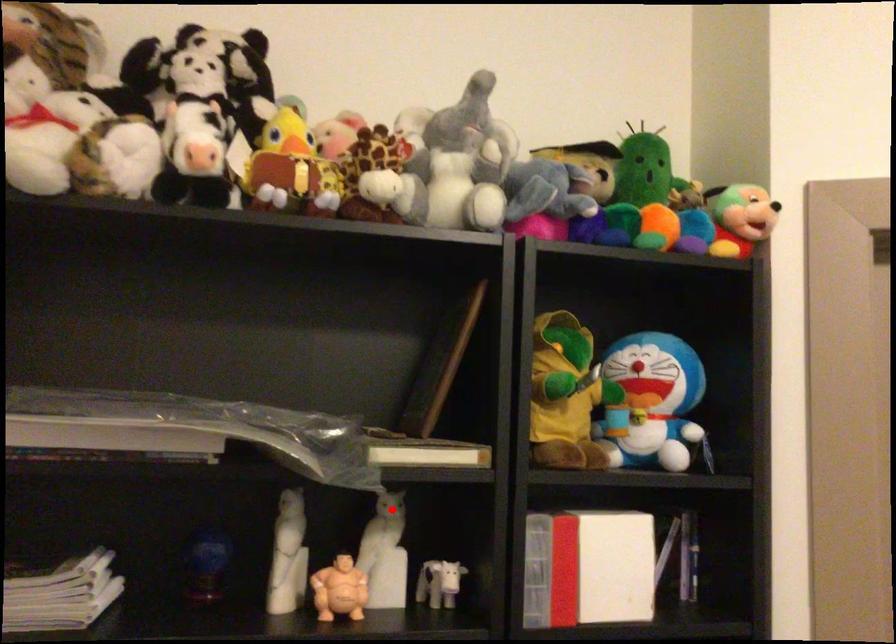
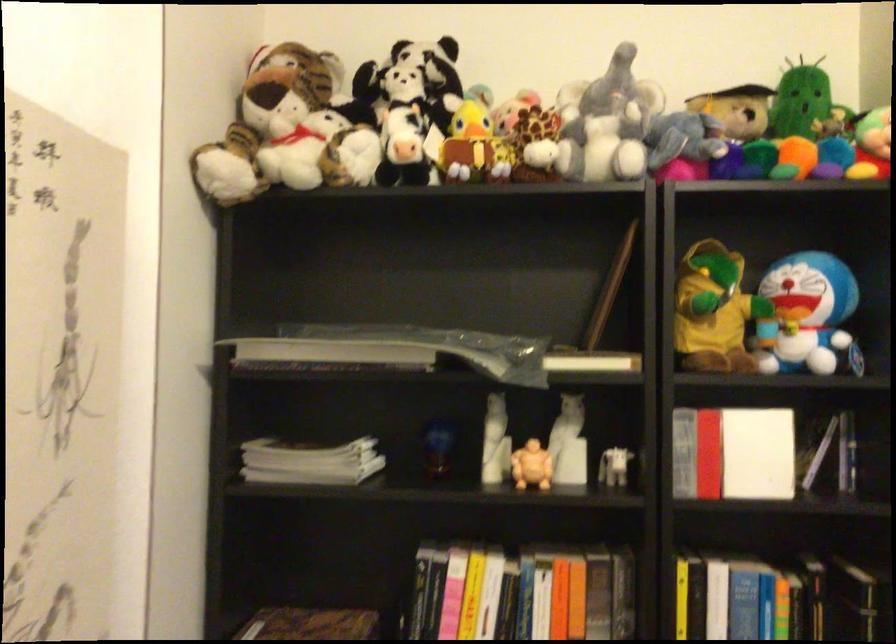
In the second image, find the point that corresponds to the highlighted location in the first image.

(572, 409)